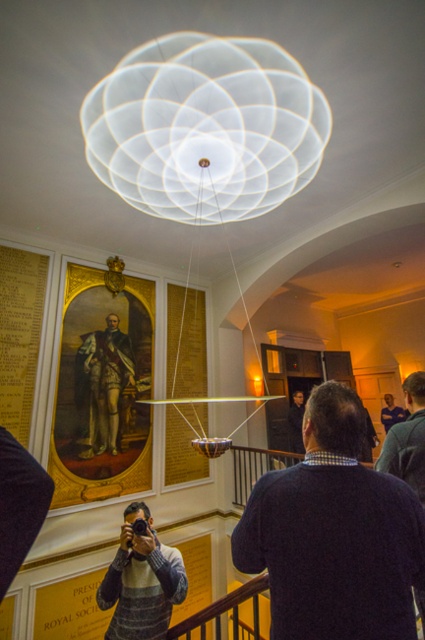
Question: Among these points, which one is nearest to the camera?

Choices:
 (A) (104, 333)
 (B) (119, 572)

Answer: (B)

Question: Which of the following is the closest to the observer?

Choices:
 (A) dark blue sweater at center
 (B) striped sweater at center

Answer: (A)

Question: Can you confirm if dark blue sweater at center is wider than striped sweater at center?

Choices:
 (A) no
 (B) yes

Answer: (A)

Question: Which point is farther to the camera?

Choices:
 (A) dark blue sweater at lower right
 (B) gold textured uniform at center
 (C) dark blue sweater at center
 (D) striped sweater at center

Answer: (B)

Question: Can you confirm if striped sweater at center is positioned above dark blue sweater at lower right?

Choices:
 (A) no
 (B) yes

Answer: (A)

Question: Can you confirm if dark blue sweater at center is positioned above gold textured uniform at center?

Choices:
 (A) yes
 (B) no

Answer: (A)